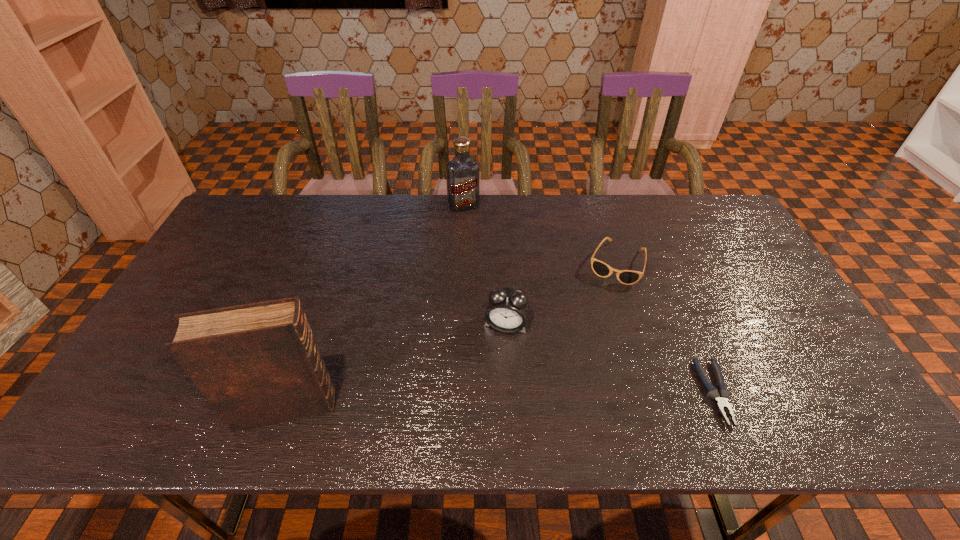
Locate an element on the screen. The image size is (960, 540). the leftmost object is located at coordinates (257, 364).

At what (x,y) coordinates should I click in order to perform the action: click on the tallest object. Please return your answer as a coordinate pair (x, y). The image size is (960, 540). Looking at the image, I should click on (257, 364).

Image resolution: width=960 pixels, height=540 pixels. Identify the location of the shortest object. (720, 396).

Locate an element on the screen. The image size is (960, 540). the rightmost object is located at coordinates (720, 396).

Where is `the second shortest object`? This screenshot has width=960, height=540. the second shortest object is located at coordinates (628, 277).

This screenshot has width=960, height=540. In order to click on the second farthest object in this screenshot , I will do `click(628, 277)`.

The width and height of the screenshot is (960, 540). What are the coordinates of `the fourth shortest object` in the screenshot? It's located at (462, 171).

The height and width of the screenshot is (540, 960). What are the coordinates of `vodka` in the screenshot? It's located at (462, 171).

At what (x,y) coordinates should I click in order to perform the action: click on the third nearest object. Please return your answer as a coordinate pair (x, y). This screenshot has width=960, height=540. Looking at the image, I should click on (507, 310).

The image size is (960, 540). In order to click on alarm clock in this screenshot , I will do `click(507, 310)`.